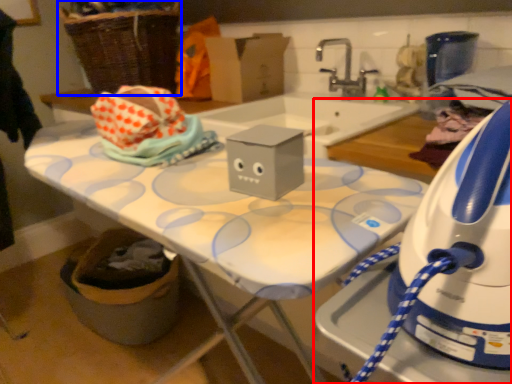
Question: Which point is closer to the camera, home appliance (highlighted by a red box) or basket (highlighted by a blue box)?

Choices:
 (A) home appliance
 (B) basket

Answer: (A)